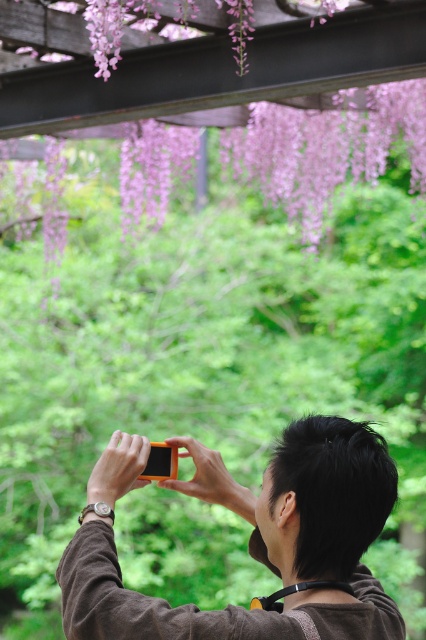
Can you confirm if orange matte camera at center is positioned to the left of purple matte flowers at upper center?

Incorrect, orange matte camera at center is not on the left side of purple matte flowers at upper center.

Is point (345, 630) positioned before point (120, 92)?

Yes, it is in front of point (120, 92).

This screenshot has height=640, width=426. What are the coordinates of `orange matte camera at center` in the screenshot? It's located at (250, 540).